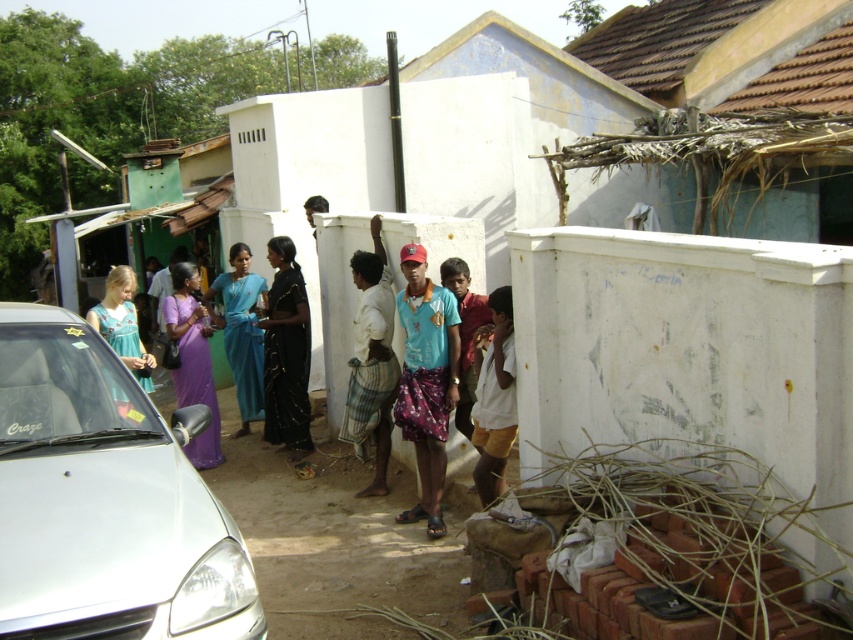
You are standing in the scene and want to take a photo of both the point at coordinates (409,273) and the point at coordinates (309,444). Which point will appear larger in the photo?

The point at coordinates (409,273) will appear larger in the photo because it is closer to the camera than the point at coordinates (309,444).

You are a photographer trying to capture a portrait of the white cotton shirt at center and the purple satin saree at center. Since both are in the same area, which one would appear closer to the camera in the photo?

The white cotton shirt at center appears closer to the camera because it is in front of the purple satin saree at center.

You are organizing a photo shoot and need to ensure that all clothing items are visible in the frame. Given that the white cotton shirt at center and the purple satin saree at center are both in the center, which clothing item might require more careful positioning to ensure it is fully captured in the photo?

The purple satin saree at center requires more careful positioning because it occupies more space than the white cotton shirt at center, so it might need more room to ensure the entire garment is visible in the frame.